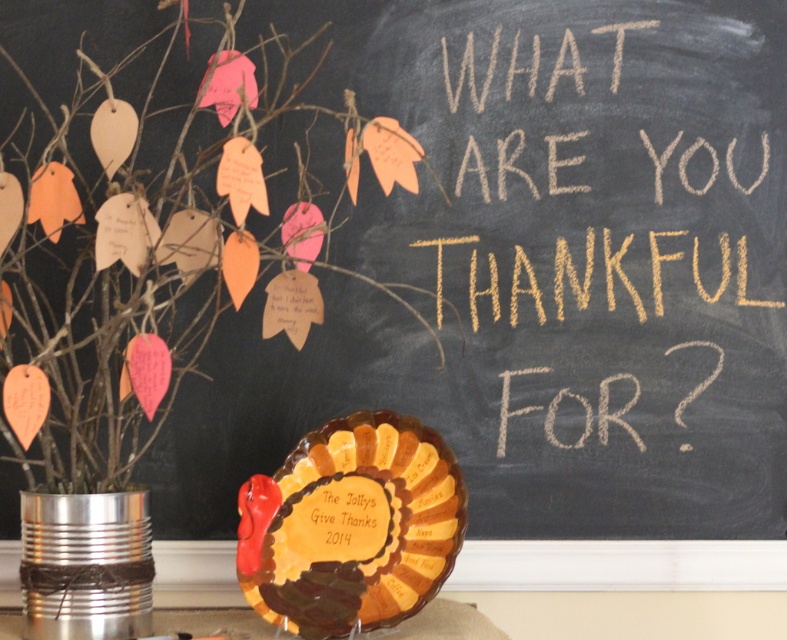
Question: Is chalk/blackboard at upper center to the left of metallic tin can at lower left from the viewer's perspective?

Choices:
 (A) no
 (B) yes

Answer: (A)

Question: Based on their relative distances, which object is nearer to the chalk/blackboard at upper center?

Choices:
 (A) metallic tin can at lower left
 (B) brown glossy turkey plate at center

Answer: (B)

Question: Is chalk/blackboard at upper center to the right of metallic tin can at lower left from the viewer's perspective?

Choices:
 (A) no
 (B) yes

Answer: (B)

Question: Which is nearer to the chalk/blackboard at upper center?

Choices:
 (A) brown glossy turkey plate at center
 (B) metallic tin can at lower left

Answer: (A)

Question: Which point is closer to the camera?

Choices:
 (A) metallic tin can at lower left
 (B) brown glossy turkey plate at center
 (C) chalk/blackboard at upper center

Answer: (A)

Question: Is brown glossy turkey plate at center positioned at the back of chalk/blackboard at upper center?

Choices:
 (A) yes
 (B) no

Answer: (B)